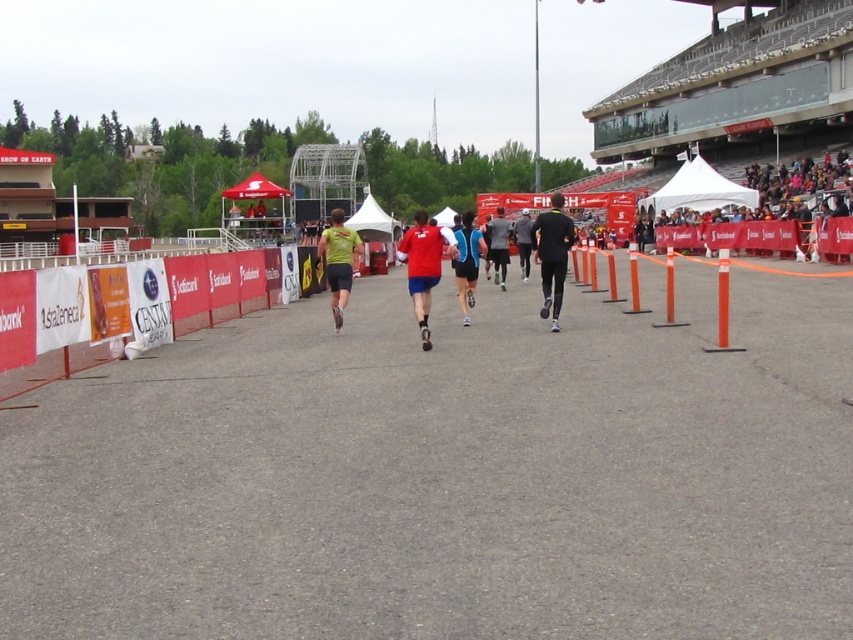
You are a photographer positioned at the finish line of the running event. You want to take a photo that includes both the point at coordinates point (676, 609) and point (543, 260). Which point should you focus on first to ensure both are in focus?

You should focus on point (676, 609) first because it is closer to the camera than point (543, 260), ensuring both points are within the depth of field.

You are a runner approaching the finish line in the stadium. You notice two points marked on the path ahead. The first is at point (553, 326) and the second is at point (492, 259). Which point should you reach first?

You should reach point (553, 326) first because it is in front of point (492, 259) along the path towards the finish line.